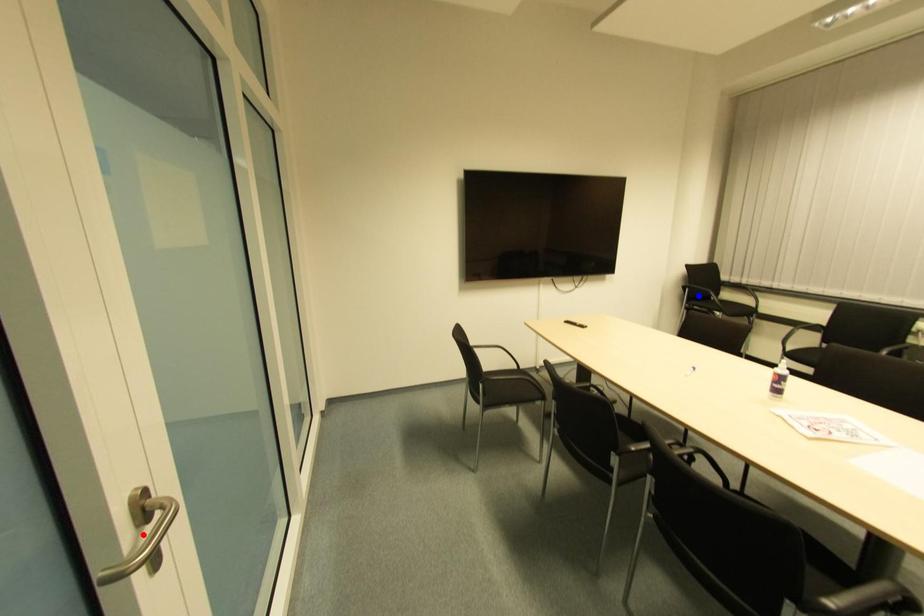
Question: Two points are marked on the image. Which point is closer to the camera?

Choices:
 (A) Blue point is closer.
 (B) Red point is closer.

Answer: (B)